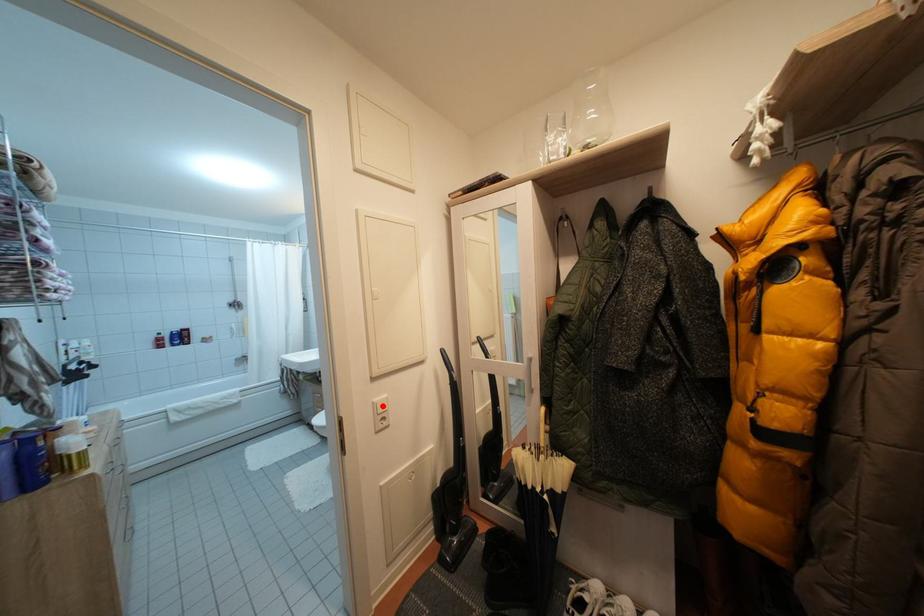
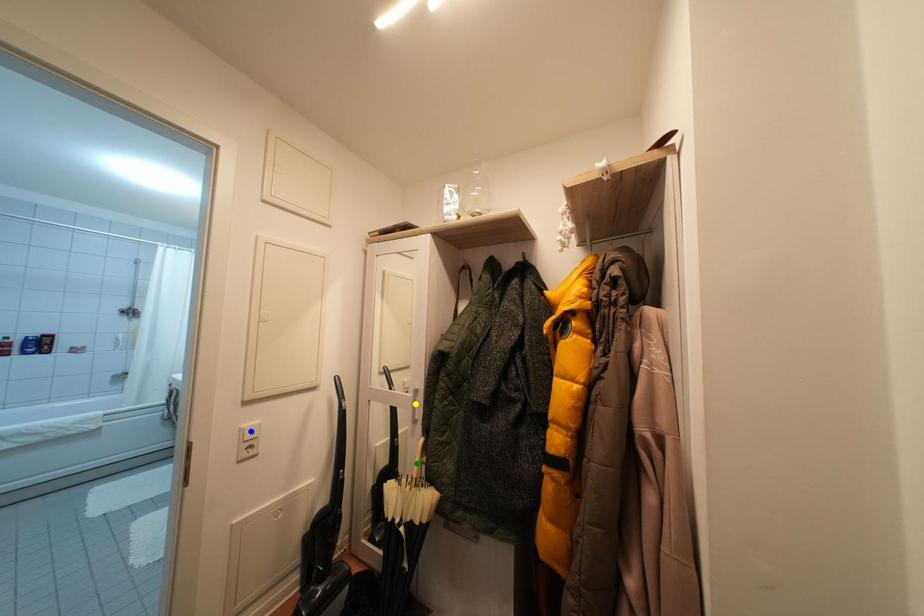
Question: I am providing you with two images of the same scene from different viewpoints. A red point is marked on the first image. You are given multiple points on the second image. Can you choose the point in image 2 that corresponds to the point in image 1?

Choices:
 (A) blue point
 (B) green point
 (C) yellow point

Answer: (A)